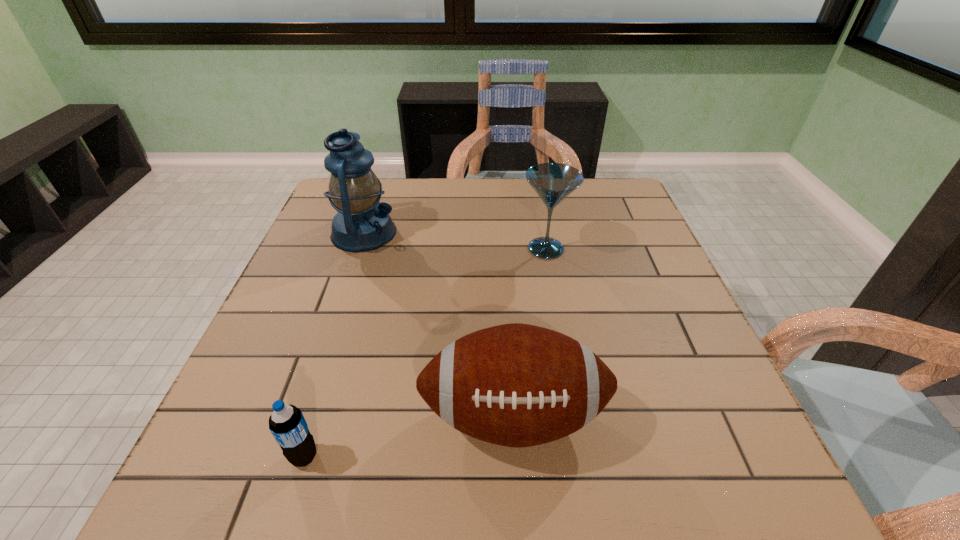
At what (x,y) coordinates should I click in order to perform the action: click on free point between the football and the lantern. Please return your answer as a coordinate pair (x, y). Looking at the image, I should click on (439, 325).

The image size is (960, 540). I want to click on vacant region between the soda bottle and the football, so click(409, 437).

Where is `vacant point located between the martini and the soda bottle`? The height and width of the screenshot is (540, 960). vacant point located between the martini and the soda bottle is located at coordinates (x=425, y=353).

This screenshot has height=540, width=960. Find the location of `vacant region between the shortest object and the martini`. vacant region between the shortest object and the martini is located at coordinates (425, 353).

The height and width of the screenshot is (540, 960). I want to click on free point between the soda bottle and the lantern, so click(334, 345).

Locate an element on the screen. Image resolution: width=960 pixels, height=540 pixels. free space that is in between the tallest object and the martini is located at coordinates (455, 241).

Select which object appears as the second closest to the shortest object. Please provide its 2D coordinates. Your answer should be formatted as a tuple, i.e. [(x, y)], where the tuple contains the x and y coordinates of a point satisfying the conditions above.

[(362, 223)]

The width and height of the screenshot is (960, 540). Find the location of `object that is the closest to the shortest object`. object that is the closest to the shortest object is located at coordinates (517, 385).

In order to click on free space that satisfies the following two spatial constraints: 1. on the face of the lantern; 2. on the left side of the martini in this screenshot , I will do `click(358, 249)`.

I want to click on free space that satisfies the following two spatial constraints: 1. on the back side of the martini; 2. on the face of the lantern, so click(542, 233).